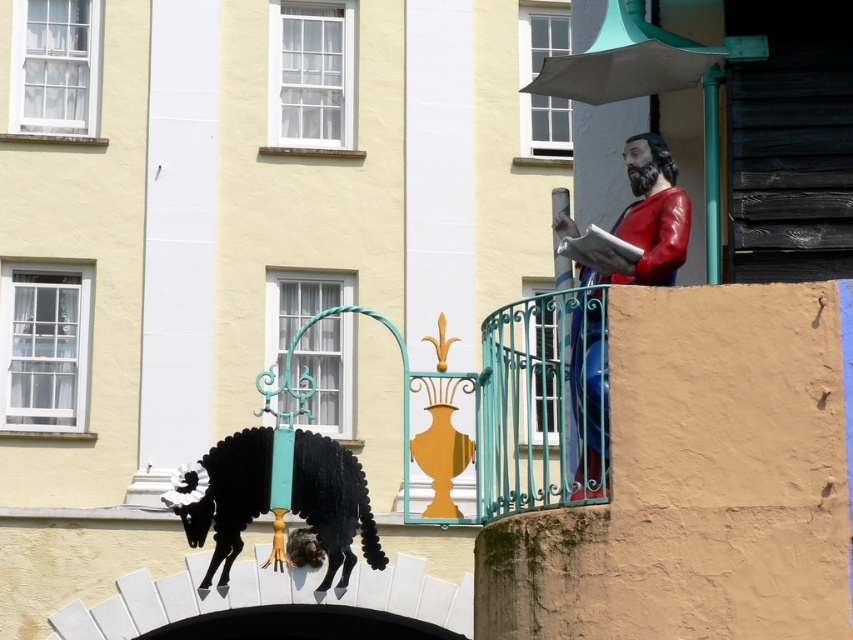
Question: Which of the following is the closest to the observer?

Choices:
 (A) pos(602,332)
 (B) pos(375,556)

Answer: (A)

Question: Does black matte ram at lower left appear under shiny red statue at upper right?

Choices:
 (A) no
 (B) yes

Answer: (B)

Question: Does black matte ram at lower left appear on the left side of shiny red statue at upper right?

Choices:
 (A) no
 (B) yes

Answer: (B)

Question: Which point is farther to the camera?

Choices:
 (A) (635, 196)
 (B) (270, 474)

Answer: (A)

Question: Can you confirm if black matte ram at lower left is bigger than shiny red statue at upper right?

Choices:
 (A) yes
 (B) no

Answer: (A)

Question: Which of the following is the farthest from the observer?

Choices:
 (A) shiny red statue at upper right
 (B) black matte ram at lower left

Answer: (B)